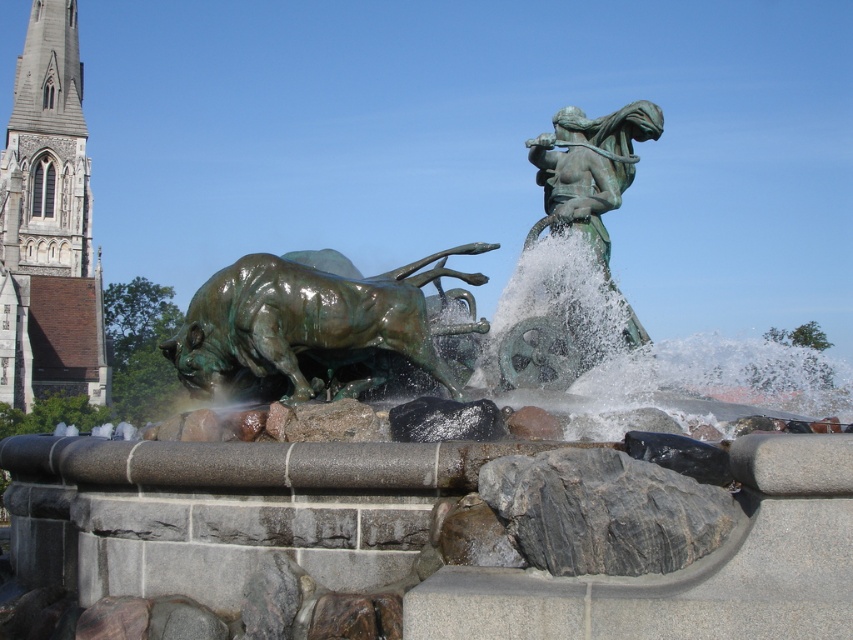
Question: Can you confirm if stone tower at left is bigger than bronze/greenish patina bull at center?

Choices:
 (A) no
 (B) yes

Answer: (B)

Question: Which object appears farthest from the camera in this image?

Choices:
 (A) stone tower at left
 (B) bronze/greenish patina bull at center
 (C) bronze statue at upper right

Answer: (A)

Question: In this image, where is stone tower at left located relative to bronze/greenish patina bull at center?

Choices:
 (A) right
 (B) left

Answer: (B)

Question: Which of these objects is positioned closest to the bronze/greenish patina bull at center?

Choices:
 (A) bronze statue at upper right
 (B) stone tower at left

Answer: (A)

Question: Estimate the real-world distances between objects in this image. Which object is farther from the bronze statue at upper right?

Choices:
 (A) bronze/greenish patina bull at center
 (B) stone tower at left

Answer: (B)

Question: Is bronze/greenish patina bull at center to the left of bronze statue at upper right from the viewer's perspective?

Choices:
 (A) yes
 (B) no

Answer: (A)